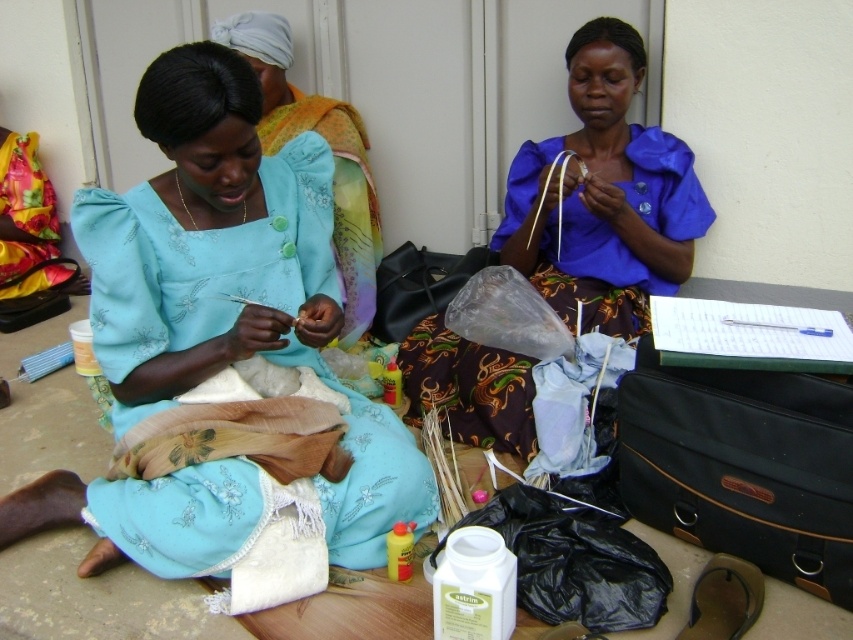
Question: Which point is closer to the camera?

Choices:
 (A) matte blue blouse at center
 (B) blue satin blouse at center

Answer: (B)

Question: Estimate the real-world distances between objects in this image. Which object is closer to the matte blue fabric at center?

Choices:
 (A) blue satin blouse at center
 (B) matte blue blouse at center

Answer: (B)

Question: Is matte blue fabric at center closer to camera compared to blue satin blouse at center?

Choices:
 (A) no
 (B) yes

Answer: (B)

Question: Does matte blue fabric at center appear over blue satin blouse at center?

Choices:
 (A) no
 (B) yes

Answer: (A)

Question: Which point is farther from the camera taking this photo?

Choices:
 (A) (619, 205)
 (B) (114, 211)

Answer: (A)

Question: Can you confirm if matte blue fabric at center is positioned to the right of matte blue blouse at center?

Choices:
 (A) yes
 (B) no

Answer: (B)